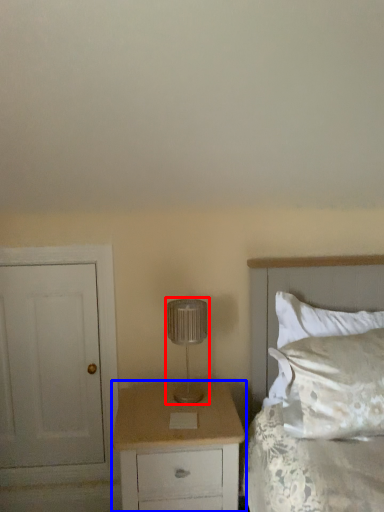
Question: Which object is further to the camera taking this photo, lamp (highlighted by a red box) or chest of drawers (highlighted by a blue box)?

Choices:
 (A) lamp
 (B) chest of drawers

Answer: (A)